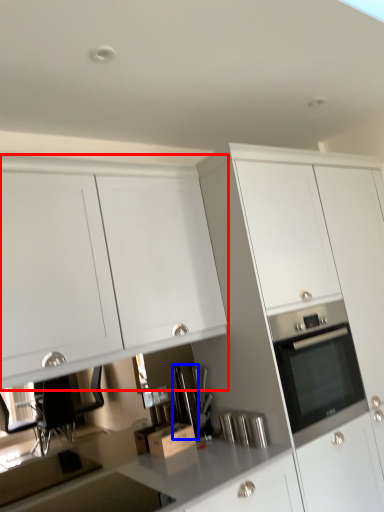
Question: Which of the following is the farthest to the observer, cabinetry (highlighted by a red box) or appliance (highlighted by a blue box)?

Choices:
 (A) cabinetry
 (B) appliance

Answer: (B)